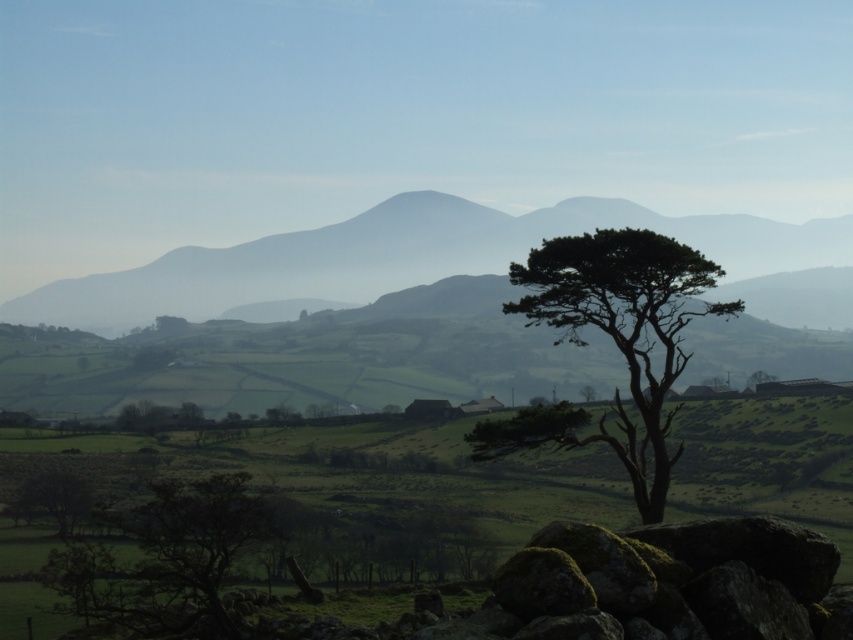
What do you see at coordinates (425, 262) in the screenshot? The width and height of the screenshot is (853, 640). I see `silvery gray mountain at center` at bounding box center [425, 262].

Is silvery gray mountain at center wider than dark green textured tree at center?

Indeed, silvery gray mountain at center has a greater width compared to dark green textured tree at center.

Between point (209, 280) and point (525, 436), which one is positioned in front?

Point (525, 436) is more forward.

Find the location of a particular element. The height and width of the screenshot is (640, 853). silvery gray mountain at center is located at coordinates (425, 262).

I want to click on silvery gray mountain at center, so click(425, 262).

Is point (741, 216) farther from viewer compared to point (68, 500)?

Yes.

The height and width of the screenshot is (640, 853). In order to click on silvery gray mountain at center in this screenshot , I will do `click(425, 262)`.

Does point (660, 512) lie behind point (84, 493)?

No, (660, 512) is closer to viewer.

Is dark green textured tree at center taller than green leafy tree at lower left?

Yes.

Who is more forward, (653,429) or (45,500)?

Point (653,429) is in front.

The width and height of the screenshot is (853, 640). In order to click on dark green textured tree at center in this screenshot , I will do `click(614, 340)`.